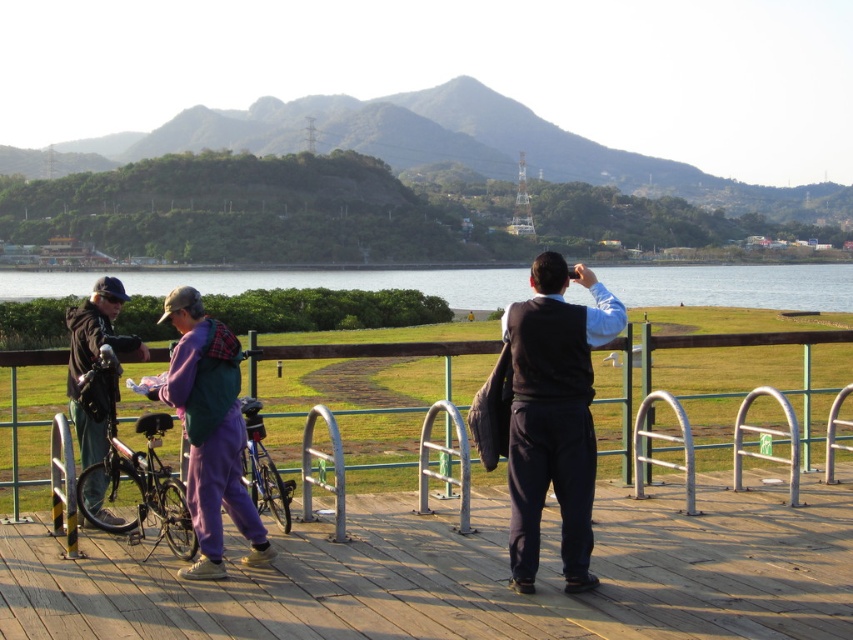
You are standing at the point labeled point (250,406) and want to walk towards the point labeled point (213,387). Which direction should you move relative to your current position?

You should move forward because point (213,387) is in front of point (250,406).

You are standing on the wooden deck and want to place a small potted plant between the shiny metallic bicycle at left and the dark gray jacket at left. Since the bicycle is shorter than the jacket, where should you place the plant so it is closer to the taller object?

Since the shiny metallic bicycle at left is shorter than the dark gray jacket at left, the plant should be placed closer to the dark gray jacket at left as it is the taller object.